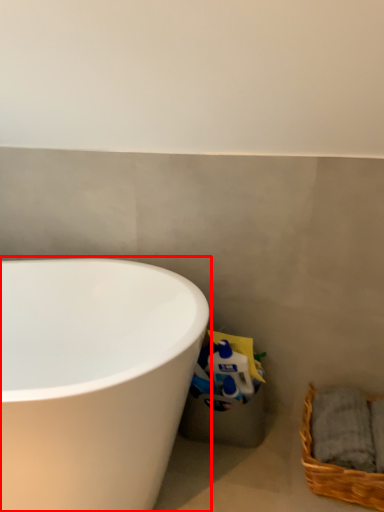
Question: In this image, where is bathtub (annotated by the red box) located relative to picnic basket?

Choices:
 (A) right
 (B) left

Answer: (B)